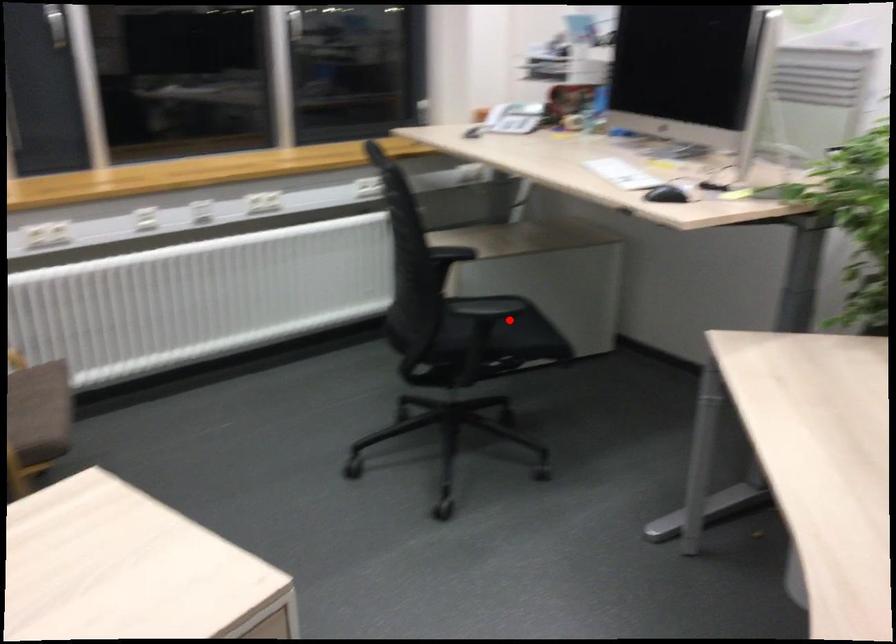
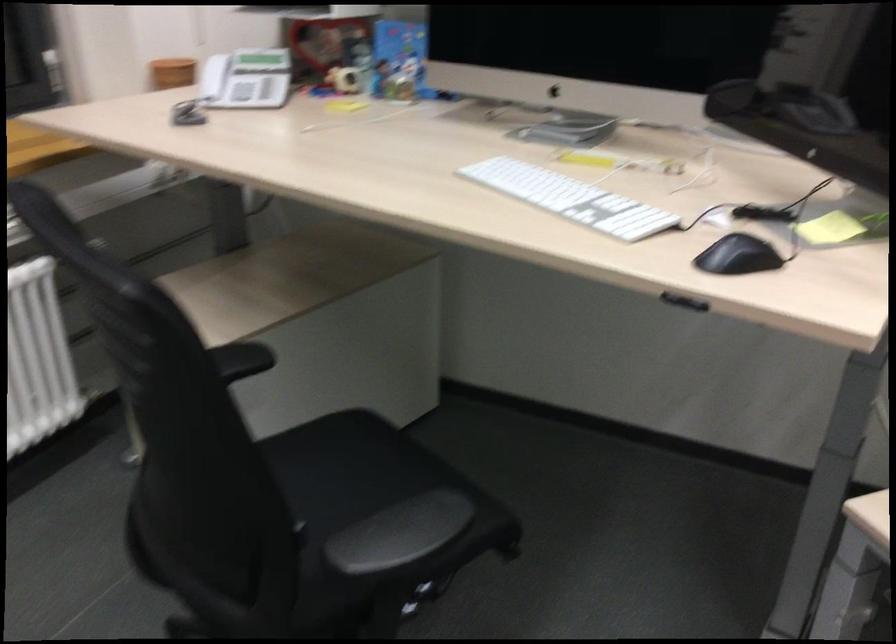
Find the pixel in the second image that matches the highlighted location in the first image.

(376, 483)